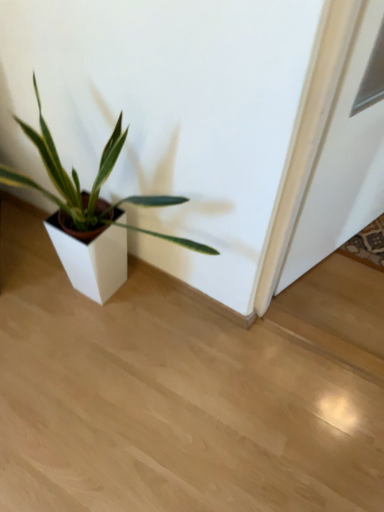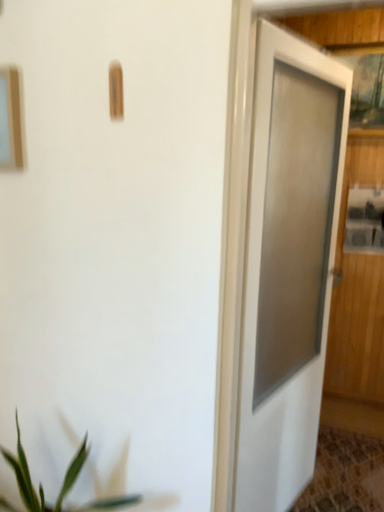
Question: How did the camera likely rotate when shooting the video?

Choices:
 (A) rotated right
 (B) rotated left

Answer: (A)